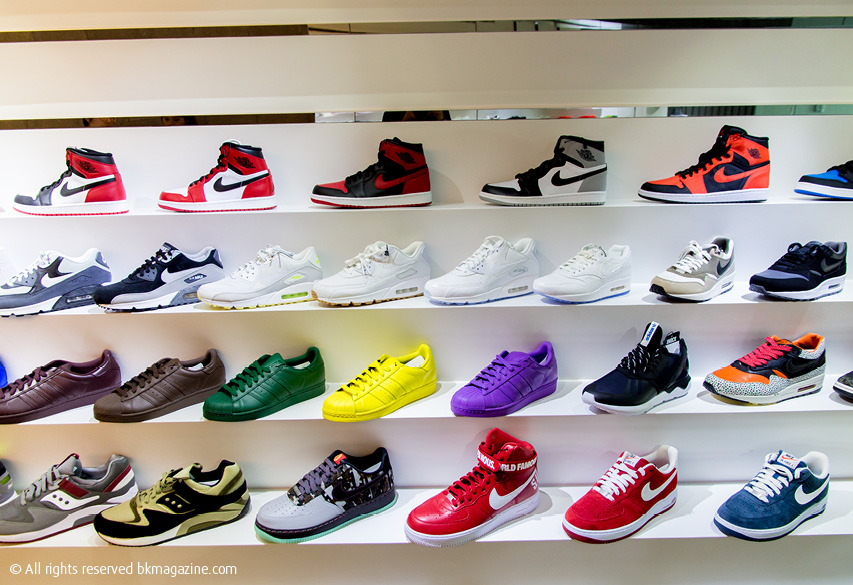
Identify the location of shoes on the top shelf. (90, 190), (234, 187), (393, 177), (549, 173), (712, 157), (836, 178).